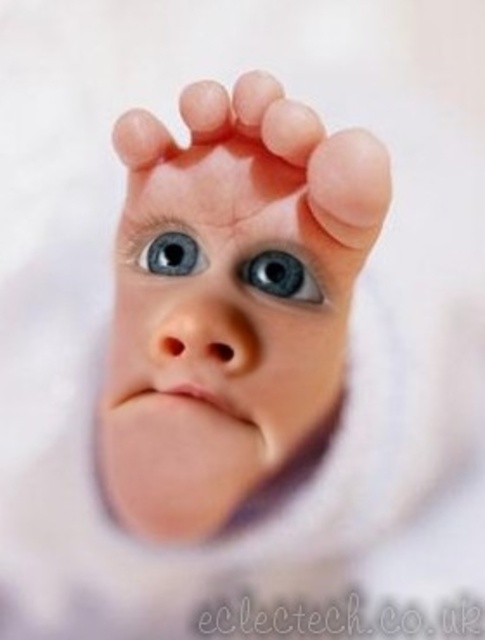
Question: Considering the real-world distances, which object is farthest from the smooth skin toe at upper center?

Choices:
 (A) pink flesh at center
 (B) pink smooth toe at center
 (C) pink flesh at upper center

Answer: (B)

Question: Among these objects, which one is nearest to the camera?

Choices:
 (A) smooth skin face at center
 (B) blue glossy eye at center

Answer: (A)

Question: Based on their relative distances, which object is nearer to the smooth skin forehead at upper center?

Choices:
 (A) pink flesh at center
 (B) pink smooth toe at center

Answer: (B)

Question: Observing the image, what is the correct spatial positioning of smooth skin forehead at upper center in reference to smooth flesh toe at upper center?

Choices:
 (A) below
 (B) above

Answer: (B)

Question: Is smooth skin face at center bigger than blue glossy eye at upper center?

Choices:
 (A) no
 (B) yes

Answer: (B)

Question: Observing the image, what is the correct spatial positioning of pink flesh at upper center in reference to blue glossy eye at upper center?

Choices:
 (A) left
 (B) right

Answer: (A)